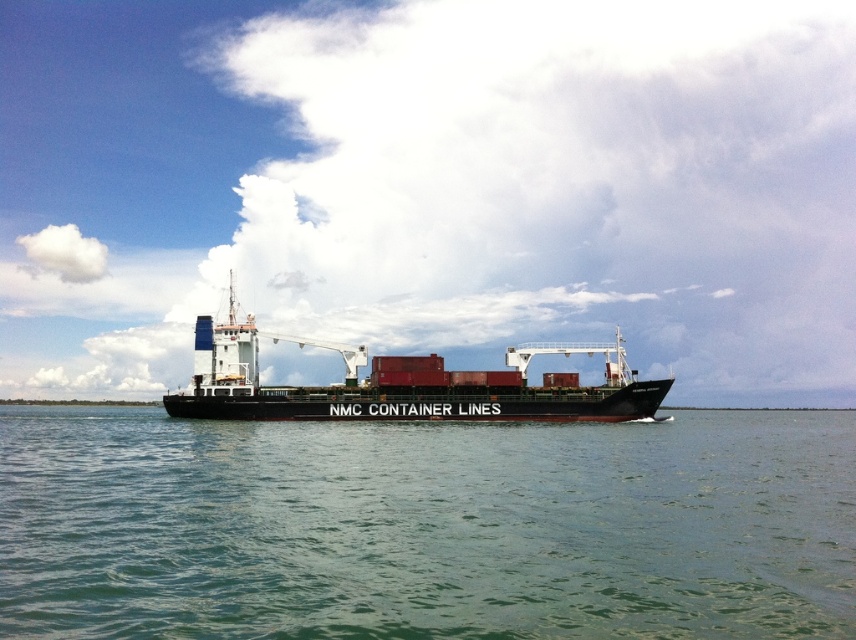
You are standing on the deck of the NMC CONTAINER LINES ship, and you want to take a photo of the point at coordinates [280,557]. If your camera has a range of 40 meters, will you be able to capture that point in your photo?

The point at coordinates [280,557] is 42.68 meters away from the camera. Since the camera has a range of 40 meters, you will not be able to capture that point in your photo.

You are a marine biologist observing the green water at center and the black matte container ship at center from a nearby island. Which object occupies a wider area in the image?

The green water at center occupies a wider area in the image than the black matte container ship at center, as its width is larger.